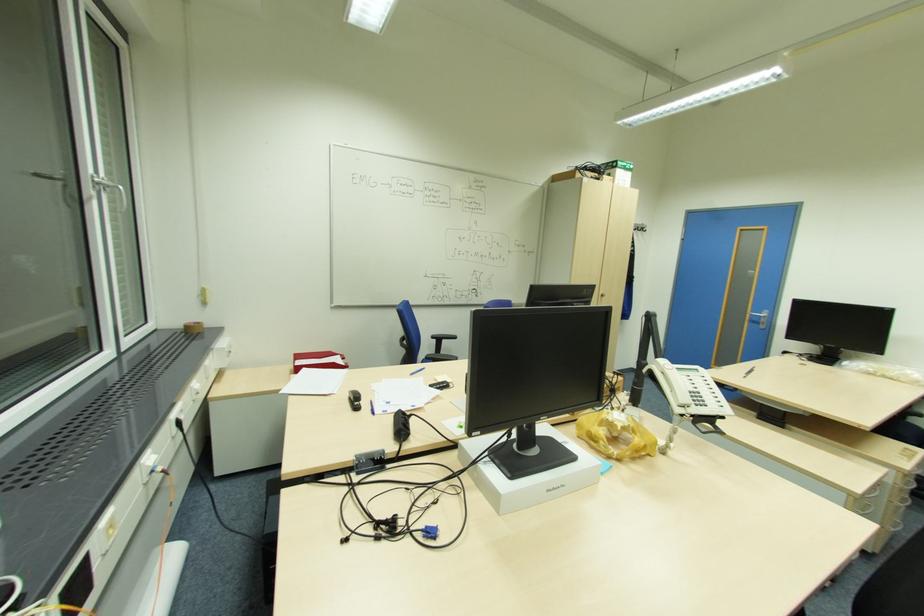
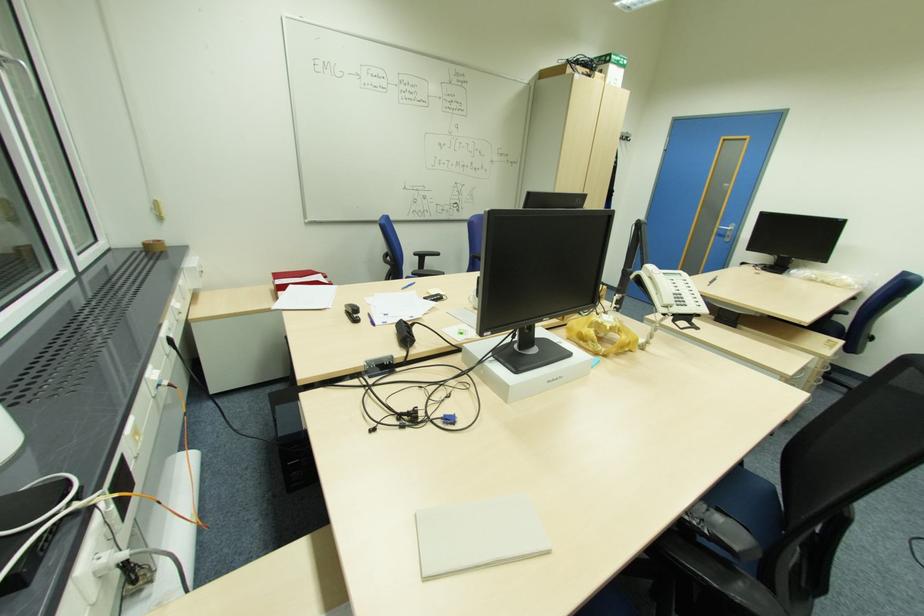
Where in the second image is the point corresponding to pixel 766 323 from the first image?

(732, 236)